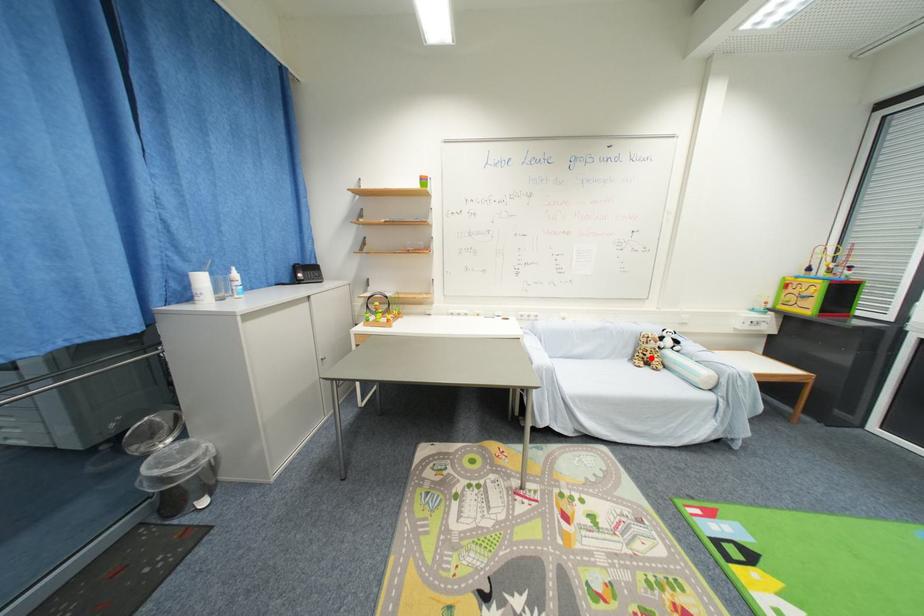
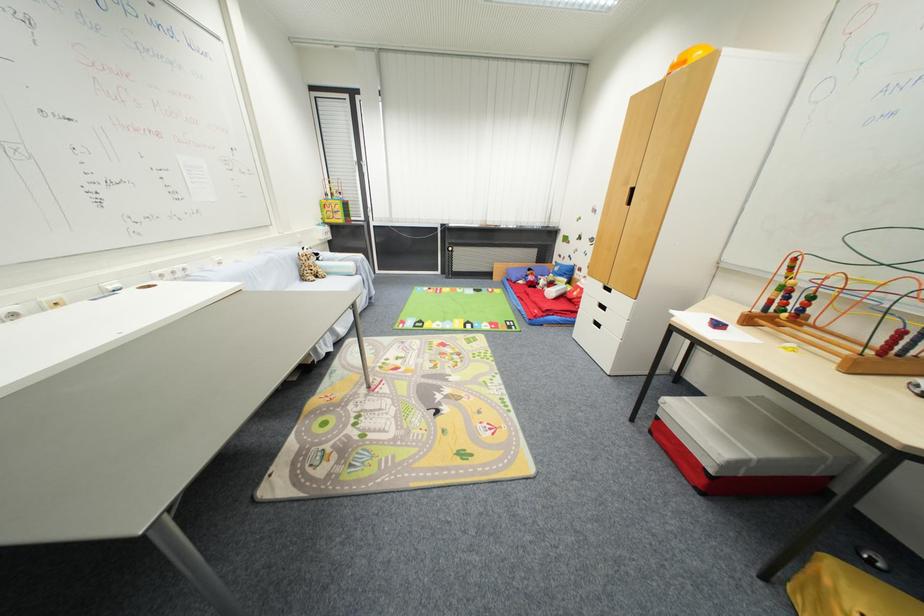
In the second image, find the point that corresponds to the highlighted location in the first image.

(313, 274)